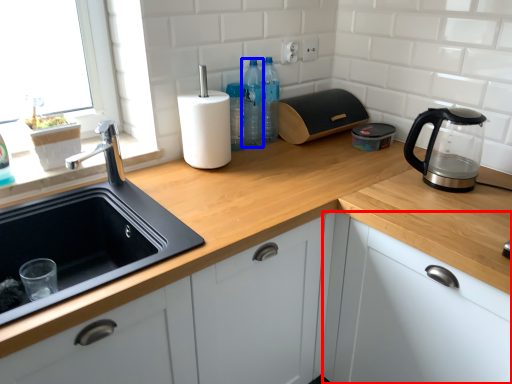
Question: Which object is closer to the camera taking this photo, cabinetry (highlighted by a red box) or bottle (highlighted by a blue box)?

Choices:
 (A) cabinetry
 (B) bottle

Answer: (A)